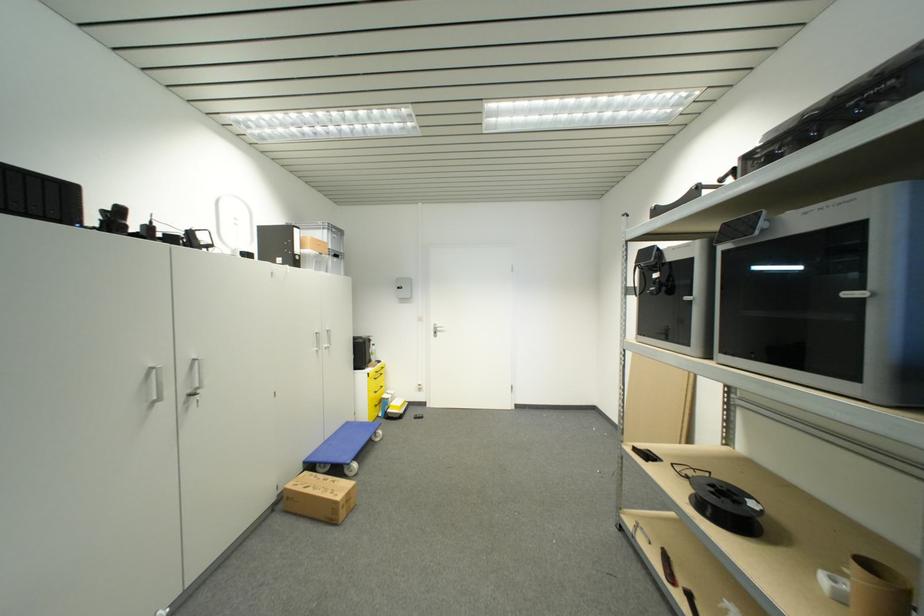
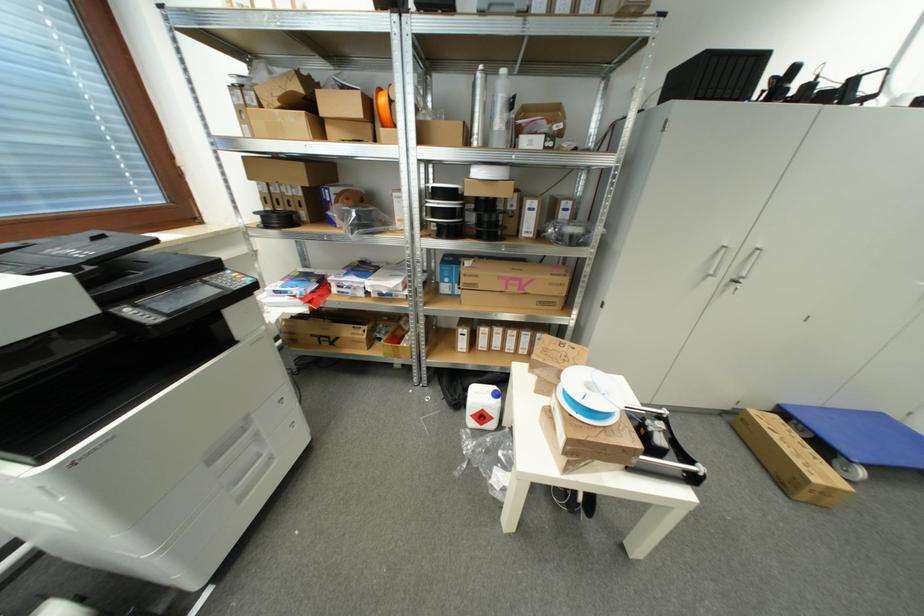
The point at [351,426] is marked in the first image. Where is the corresponding point in the second image?

(885, 418)